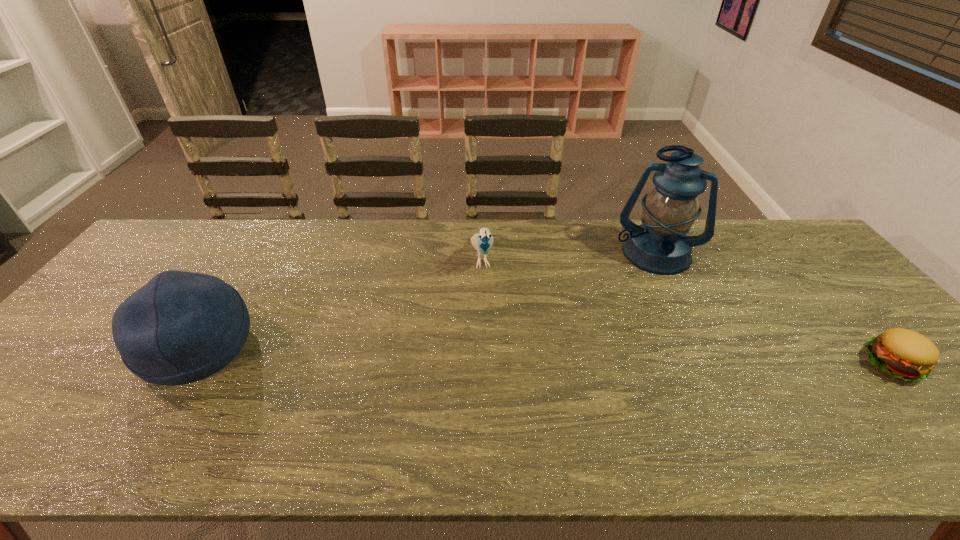
Where is `free point that satisfies the following two spatial constraints: 1. on the back side of the bird; 2. on the left side of the second object from right to left`? The width and height of the screenshot is (960, 540). free point that satisfies the following two spatial constraints: 1. on the back side of the bird; 2. on the left side of the second object from right to left is located at coordinates (482, 253).

This screenshot has height=540, width=960. Identify the location of vacant position in the image that satisfies the following two spatial constraints: 1. on the front side of the hamburger; 2. on the right side of the third tallest object. (482, 363).